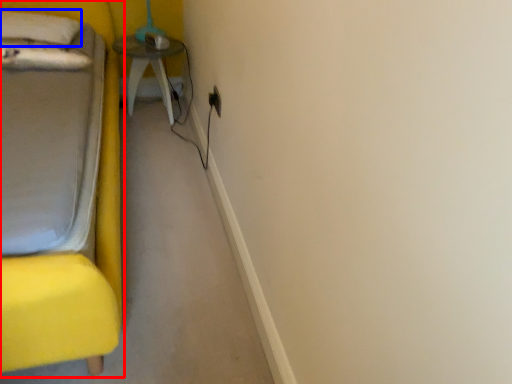
Question: Among these objects, which one is nearest to the camera, furniture (highlighted by a red box) or pillow (highlighted by a blue box)?

Choices:
 (A) furniture
 (B) pillow

Answer: (A)